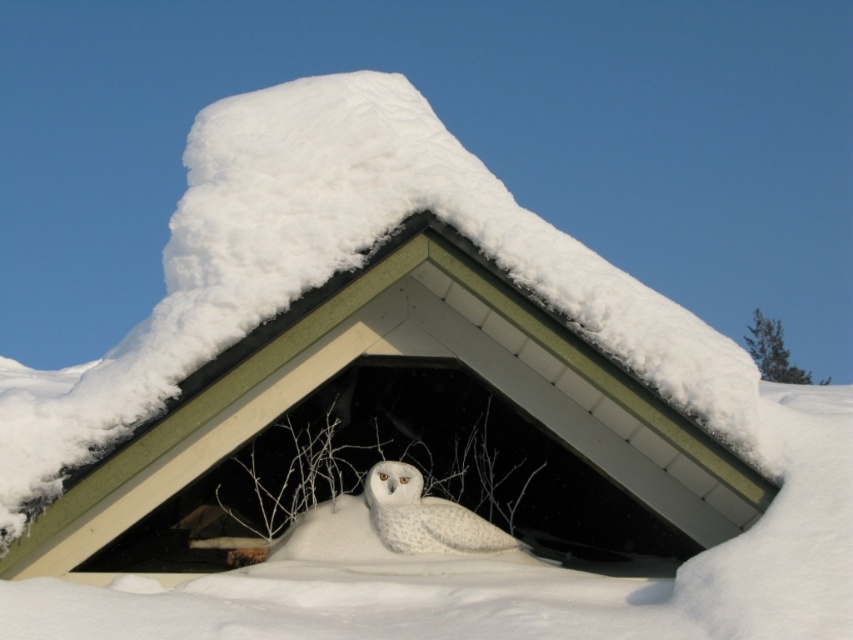
Question: Which point is farther to the camera?

Choices:
 (A) white fluffy owl at center
 (B) white matte owl at center

Answer: (A)

Question: Does white matte owl at center have a lesser width compared to white fluffy owl at center?

Choices:
 (A) yes
 (B) no

Answer: (B)

Question: Can you confirm if white matte owl at center is thinner than white fluffy owl at center?

Choices:
 (A) no
 (B) yes

Answer: (A)

Question: Which object appears closest to the camera in this image?

Choices:
 (A) white fluffy owl at center
 (B) white matte owl at center

Answer: (B)

Question: Can you confirm if white matte owl at center is smaller than white fluffy owl at center?

Choices:
 (A) no
 (B) yes

Answer: (A)